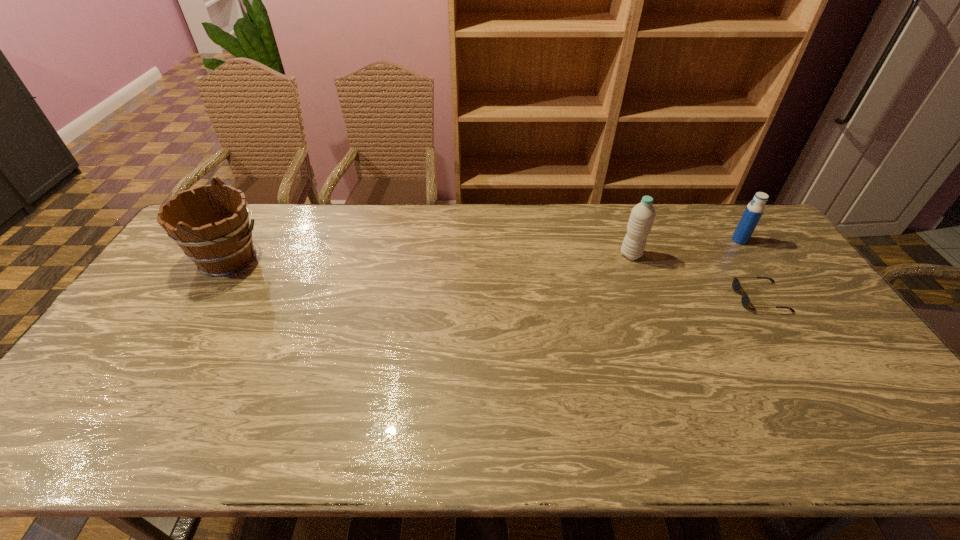
Locate an element on the screen. The height and width of the screenshot is (540, 960). free space located 0.360m on the front-facing side of the shortest object is located at coordinates (616, 297).

You are a GUI agent. You are given a task and a screenshot of the screen. Output one action in this format:
    pyautogui.click(x=<x>, y=<y>)
    Task: Click on the free space located on the front-facing side of the shortest object
    The height and width of the screenshot is (540, 960).
    Given the screenshot: What is the action you would take?
    pyautogui.click(x=670, y=297)

Where is `wine bucket present at the far edge`? The height and width of the screenshot is (540, 960). wine bucket present at the far edge is located at coordinates (212, 227).

Find the location of a particular element. This screenshot has height=540, width=960. water bottle present at the far edge is located at coordinates (754, 210).

You are a GUI agent. You are given a task and a screenshot of the screen. Output one action in this format:
    pyautogui.click(x=<x>, y=<y>)
    Task: Click on the object situated at the left edge
    The width and height of the screenshot is (960, 540).
    Given the screenshot: What is the action you would take?
    pyautogui.click(x=212, y=227)

This screenshot has width=960, height=540. I want to click on water bottle that is positioned at the right edge, so click(754, 210).

At what (x,y) coordinates should I click in order to perform the action: click on sunglasses that is at the right edge. Please return your answer as a coordinate pair (x, y). The width and height of the screenshot is (960, 540). Looking at the image, I should click on (736, 285).

Find the location of a particular element. This screenshot has width=960, height=540. object at the far left corner is located at coordinates (212, 227).

You are a GUI agent. You are given a task and a screenshot of the screen. Output one action in this format:
    pyautogui.click(x=<x>, y=<y>)
    Task: Click on the object that is at the far right corner
    The height and width of the screenshot is (540, 960).
    Given the screenshot: What is the action you would take?
    pyautogui.click(x=754, y=210)

Identify the location of vacant area at the far edge of the desktop. Image resolution: width=960 pixels, height=540 pixels. (282, 226).